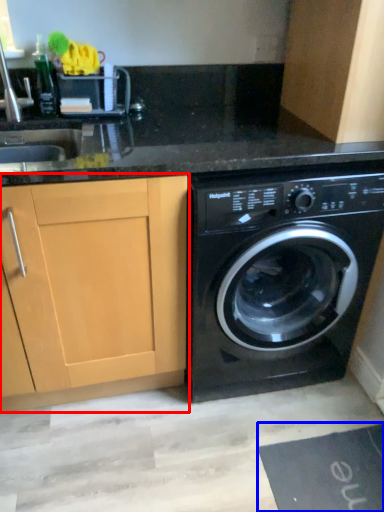
Question: Among these objects, which one is nearest to the camera, cabinetry (highlighted by a red box) or bath mat (highlighted by a blue box)?

Choices:
 (A) cabinetry
 (B) bath mat

Answer: (A)